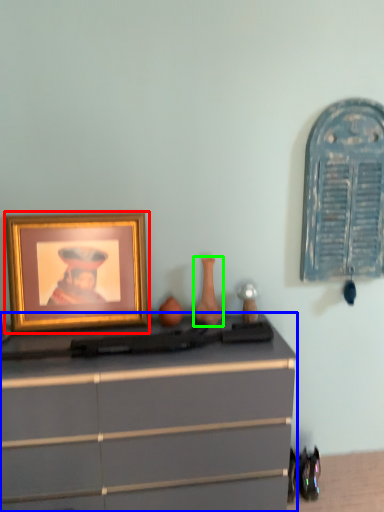
Question: Estimate the real-world distances between objects in this image. Which object is closer to picture frame (highlighted by a red box), chest of drawers (highlighted by a blue box) or vase (highlighted by a green box)?

Choices:
 (A) chest of drawers
 (B) vase

Answer: (A)